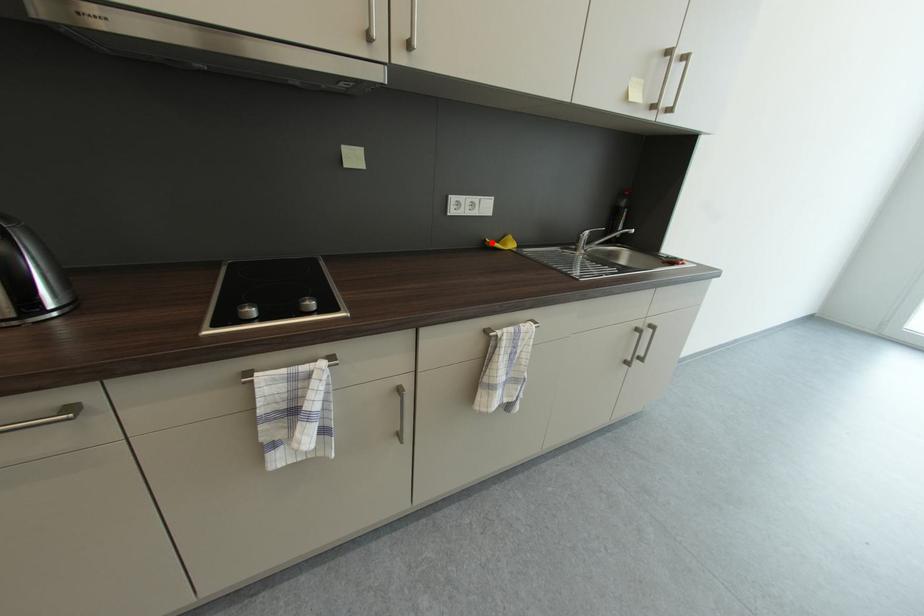
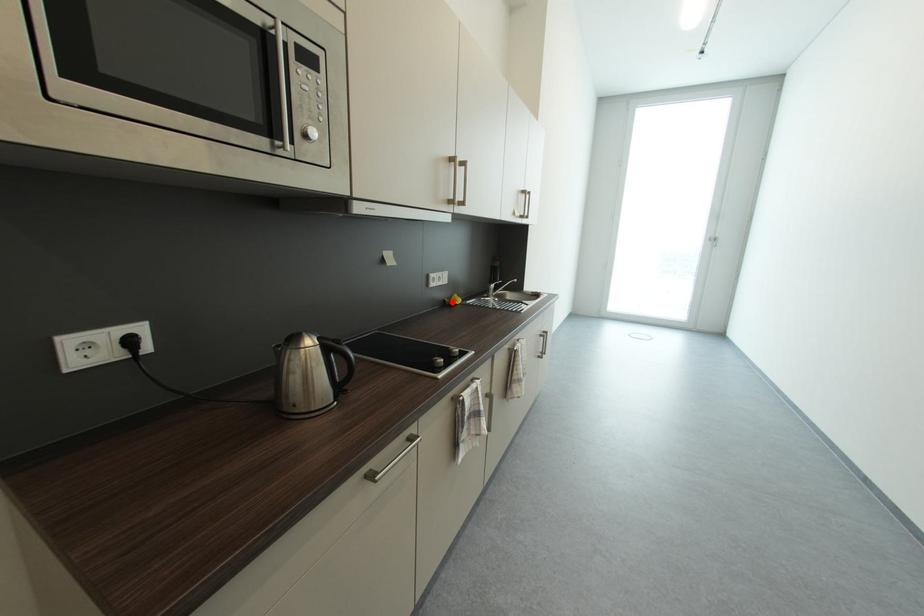
I am providing you with two images of the same scene from different viewpoints. A red point is marked on the first image and another point is marked on the second image. Does the point marked in image1 correspond to the same location as the one in image2?

Yes